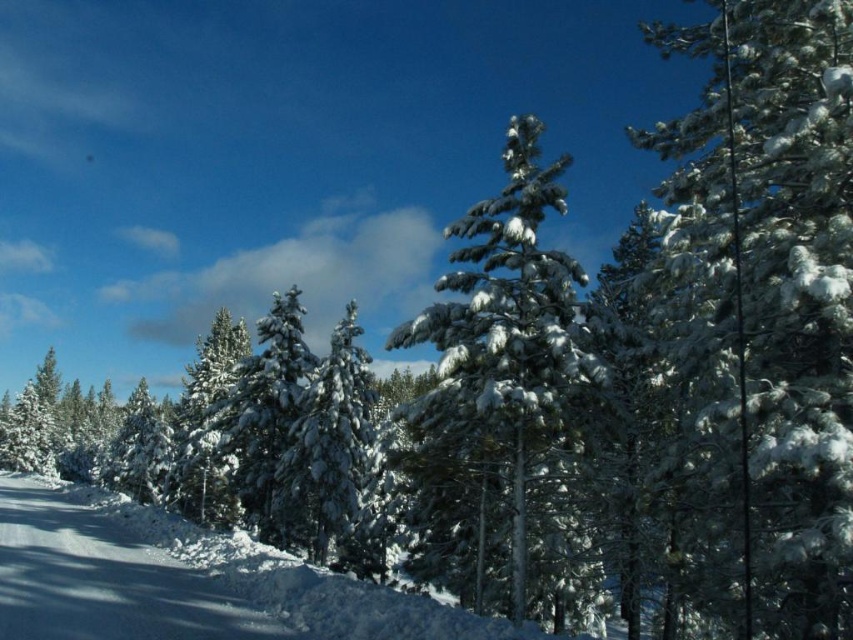
Question: Is white snow-covered tree at upper right to the right of white snow path at lower left from the viewer's perspective?

Choices:
 (A) yes
 (B) no

Answer: (A)

Question: Does white snow path at lower left have a smaller size compared to green matte tree at center?

Choices:
 (A) yes
 (B) no

Answer: (A)

Question: Which point appears farthest from the camera in this image?

Choices:
 (A) pyautogui.click(x=193, y=449)
 (B) pyautogui.click(x=248, y=620)

Answer: (A)

Question: Based on their relative distances, which object is nearer to the white snow-covered tree at center?

Choices:
 (A) green matte tree at center
 (B) snow-covered pine at center
 (C) white snow path at lower left
 (D) white snow-covered tree at upper right

Answer: (B)

Question: Which of the following is the closest to the observer?

Choices:
 (A) white snow-covered tree at center
 (B) green matte tree at center

Answer: (A)

Question: Does white snow path at lower left have a larger size compared to green matte tree at center?

Choices:
 (A) no
 (B) yes

Answer: (A)